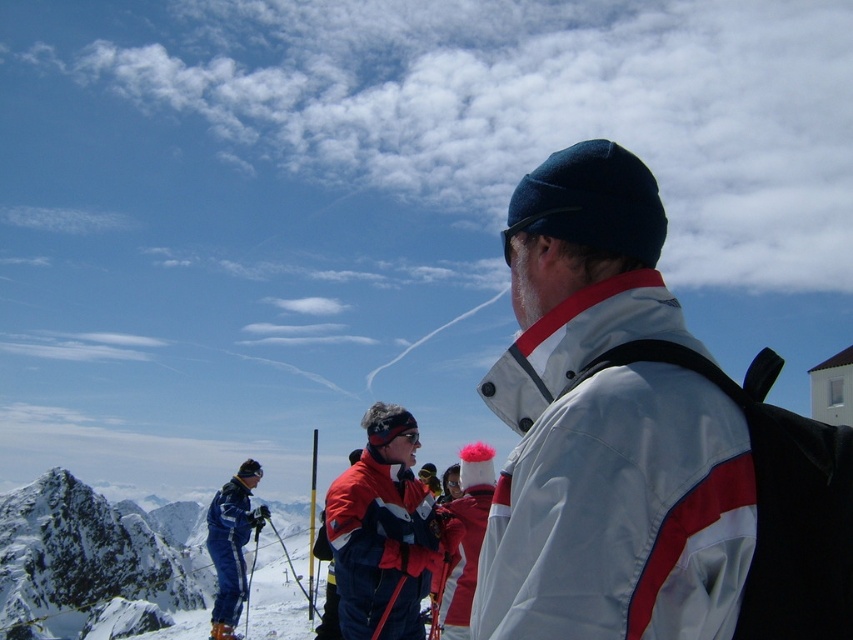
Does snowy peak at left appear on the left side of red fabric jacket at center?

Yes, snowy peak at left is to the left of red fabric jacket at center.

Between snowy peak at left and red fabric jacket at center, which one is positioned higher?

Positioned higher is red fabric jacket at center.

The height and width of the screenshot is (640, 853). Describe the element at coordinates (100, 564) in the screenshot. I see `snowy peak at left` at that location.

Where is `snowy peak at left`? This screenshot has height=640, width=853. snowy peak at left is located at coordinates (100, 564).

Which is below, white matte jacket at center or snowy peak at left?

Positioned lower is snowy peak at left.

Who is shorter, white matte jacket at center or snowy peak at left?

white matte jacket at center

Between point (625, 433) and point (3, 500), which one is positioned behind?

Point (3, 500)

Where is `white matte jacket at center`? white matte jacket at center is located at coordinates (606, 428).

Is white matte jacket at center to the left of blue ski suit at left from the viewer's perspective?

No, white matte jacket at center is not to the left of blue ski suit at left.

Which of these two, white matte jacket at center or blue ski suit at left, stands shorter?

white matte jacket at center

Who is more distant from viewer, (x=555, y=156) or (x=223, y=534)?

Point (x=223, y=534)

Identify the location of white matte jacket at center. This screenshot has width=853, height=640. (606, 428).